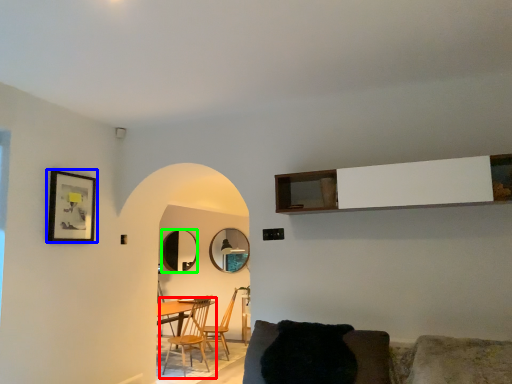
Question: Estimate the real-world distances between objects in this image. Which object is farther from chair (highlighted by a red box), picture frame (highlighted by a blue box) or mirror (highlighted by a green box)?

Choices:
 (A) picture frame
 (B) mirror

Answer: (A)